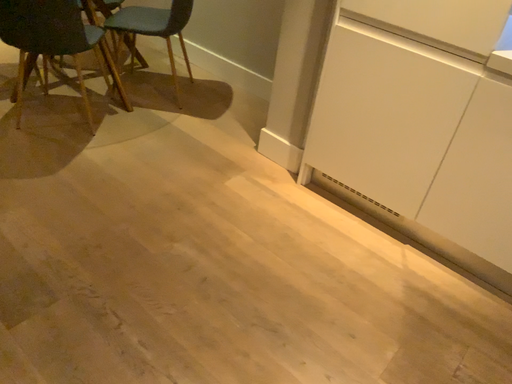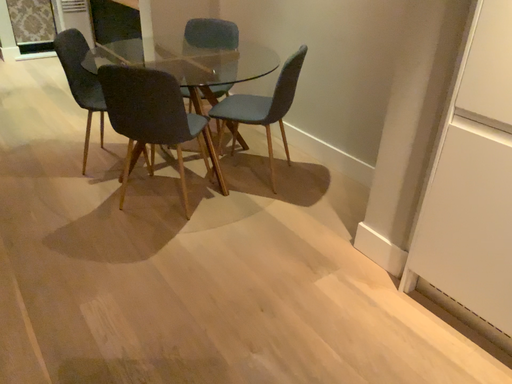
Question: How did the camera likely rotate when shooting the video?

Choices:
 (A) rotated left
 (B) rotated right

Answer: (A)